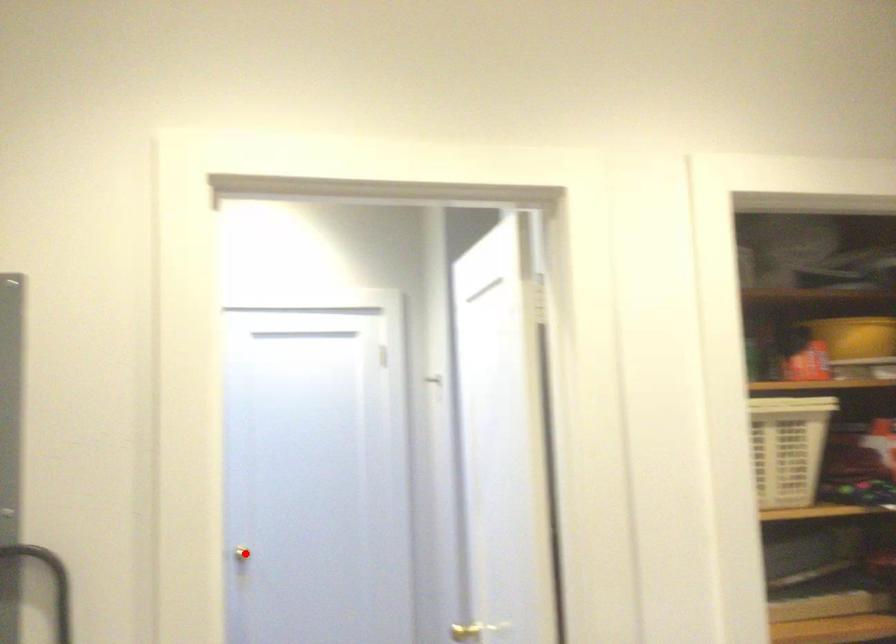
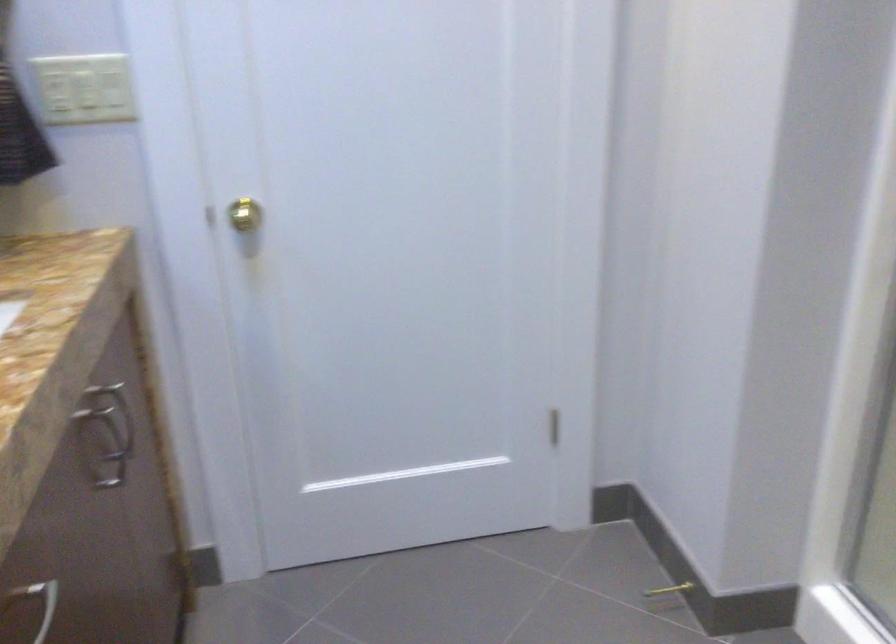
Question: I am providing you with two images of the same scene from different viewpoints. In image1, a red point is highlighted. Considering the same 3D point in image2, which of the following is correct?

Choices:
 (A) It is closer
 (B) It is farther

Answer: (A)